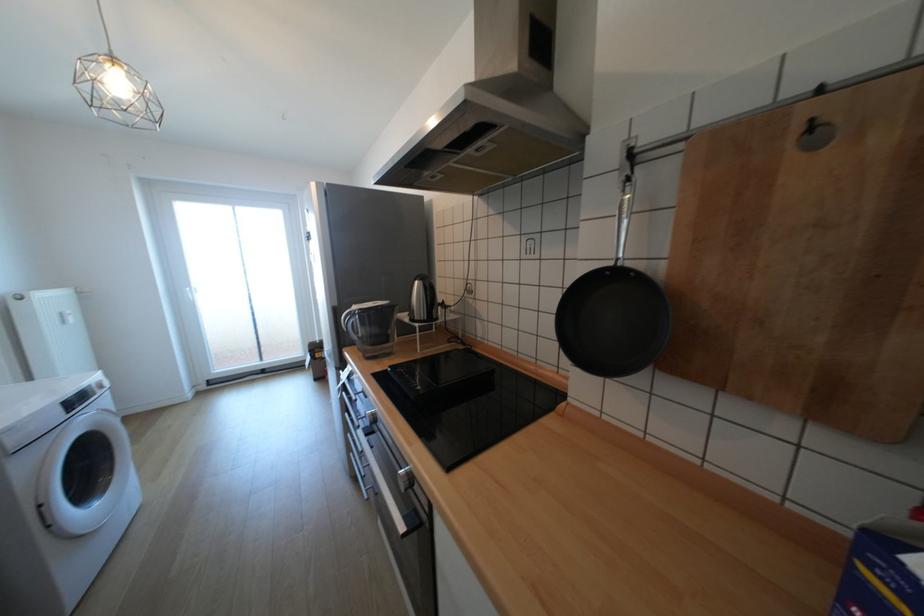
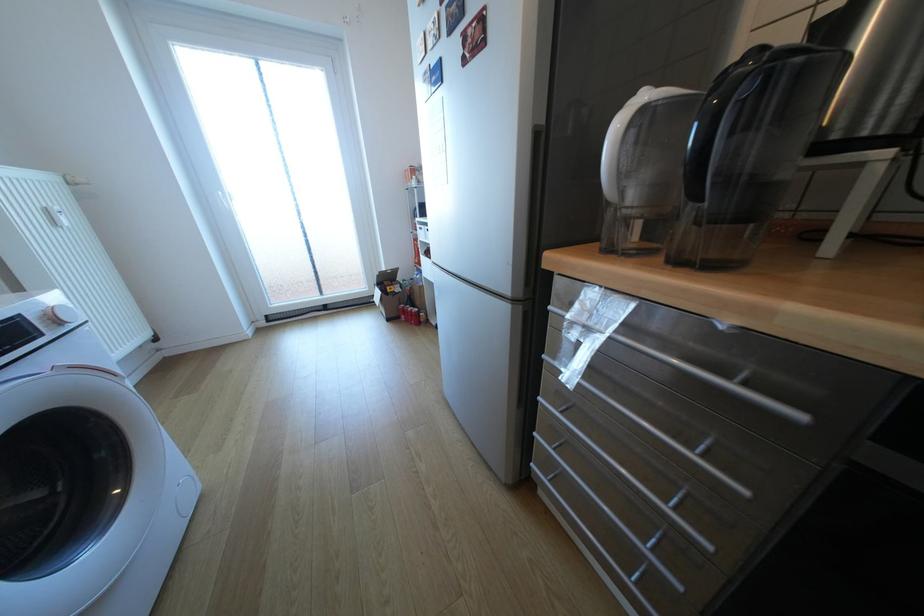
The images are taken continuously from a first-person perspective. In which direction are you moving?

The movement direction of the cameraman is left, forward.